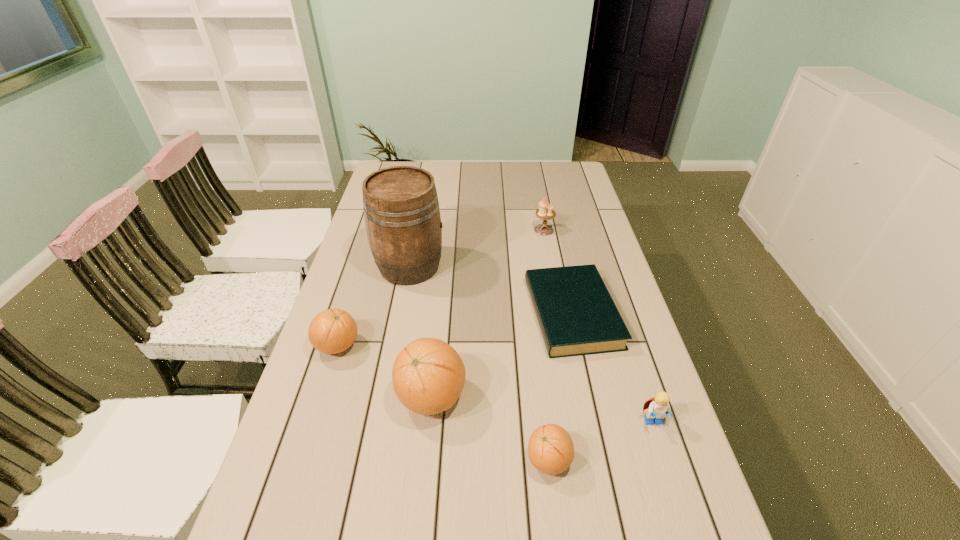
This screenshot has width=960, height=540. Find the location of `Lego`. Lego is located at coordinates (659, 406).

Where is `free location located 0.190m on the right of the farthest orange`? The width and height of the screenshot is (960, 540). free location located 0.190m on the right of the farthest orange is located at coordinates (430, 346).

At what (x,y) coordinates should I click in order to perform the action: click on vacant area situated on the back of the second farthest orange. Please return your answer as a coordinate pair (x, y). Looking at the image, I should click on (437, 336).

The height and width of the screenshot is (540, 960). I want to click on free space located on the back of the nearest object, so click(x=533, y=326).

This screenshot has height=540, width=960. I want to click on free spot located 0.070m on the right of the farthest object, so click(573, 230).

Where is `free space located on the side of the cider near the bung hole`? This screenshot has height=540, width=960. free space located on the side of the cider near the bung hole is located at coordinates (536, 266).

Where is `vacant region located 0.340m on the back of the shortest object`? The height and width of the screenshot is (540, 960). vacant region located 0.340m on the back of the shortest object is located at coordinates (551, 218).

This screenshot has height=540, width=960. I want to click on free region located on the front-facing side of the Lego, so click(671, 476).

This screenshot has height=540, width=960. In order to click on orange at the left edge in this screenshot , I will do `click(332, 331)`.

Identify the location of cider that is at the left edge. (401, 210).